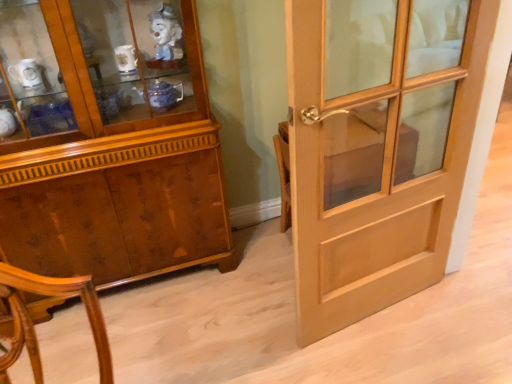
Question: Is wooden cabinet at left bigger or smaller than light brown wood door at right?

Choices:
 (A) small
 (B) big

Answer: (B)

Question: In terms of width, does wooden cabinet at left look wider or thinner when compared to light brown wood door at right?

Choices:
 (A) thin
 (B) wide

Answer: (B)

Question: Does point (62, 21) appear closer or farther from the camera than point (437, 248)?

Choices:
 (A) farther
 (B) closer

Answer: (B)

Question: From a real-world perspective, is light brown wood door at right above or below wooden cabinet at left?

Choices:
 (A) below
 (B) above

Answer: (A)

Question: Based on their sizes in the image, would you say light brown wood door at right is bigger or smaller than wooden cabinet at left?

Choices:
 (A) big
 (B) small

Answer: (B)

Question: Visually, is light brown wood door at right positioned to the left or to the right of wooden cabinet at left?

Choices:
 (A) right
 (B) left

Answer: (A)

Question: From the image's perspective, is light brown wood door at right positioned above or below wooden cabinet at left?

Choices:
 (A) above
 (B) below

Answer: (B)